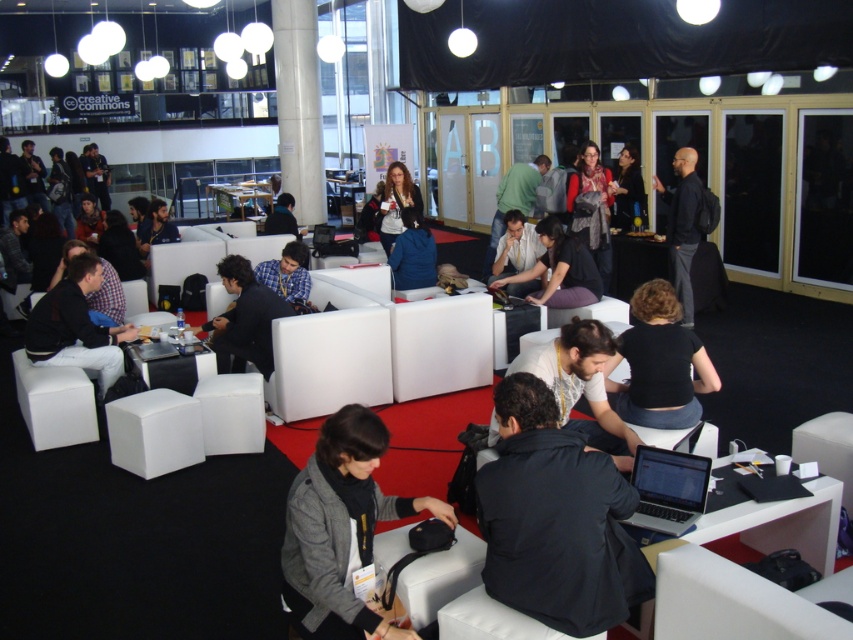
You are a guest at the event and want to sit down comfortably. The white foam chair at lower right and the dark gray fabric jacket at lower left are both in your vicinity. Which object is shorter and thus more suitable for sitting?

The white foam chair at lower right is shorter than the dark gray fabric jacket at lower left. Therefore, the white foam chair at lower right is more suitable for sitting as it is designed to be at a comfortable height for seating.

From the picture: You are organizing a small event in this space and need to place a new decorative item on the surface that is currently occupied by the dark gray fabric jacket at lower left and the silver metallic laptop at lower center. Which object should you move to make space?

The dark gray fabric jacket at lower left is above the silver metallic laptop at lower center, so you should move the dark gray fabric jacket at lower left to make space for the decorative item.